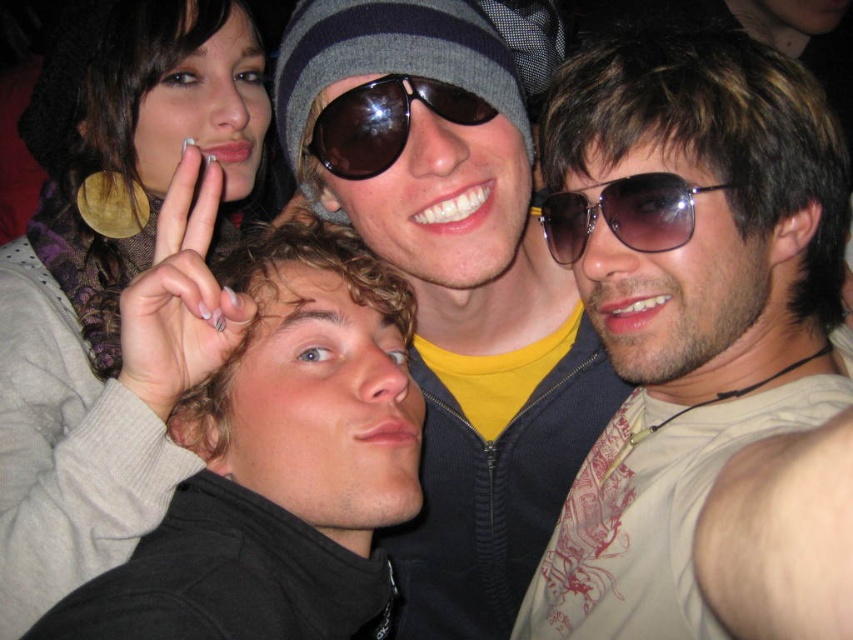
You are standing in front of the group photo. There are two points marked in the image at coordinates point (572, 202) and point (444, 99). Which point is closer to you?

Point (572, 202) is closer to you because it is further to the viewer than point (444, 99).